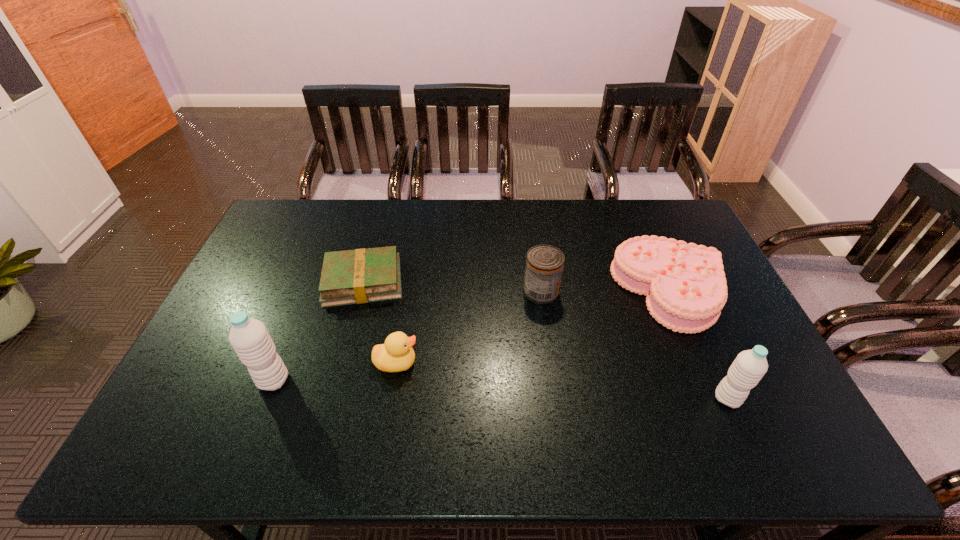
Find the location of a particular element. This screenshot has height=540, width=960. vacant region located 0.210m on the back of the shorter water bottle is located at coordinates (693, 324).

The image size is (960, 540). I want to click on vacant space located on the left of the shortest object, so click(x=261, y=282).

Where is `vacant space located on the back of the can`? The image size is (960, 540). vacant space located on the back of the can is located at coordinates (530, 210).

The height and width of the screenshot is (540, 960). I want to click on vacant space positioned on the face of the duckling, so point(471,363).

Find the location of a particular element. vacant area situated 0.130m on the front of the cake is located at coordinates (706, 374).

The image size is (960, 540). Find the location of `water bottle that is at the right edge`. water bottle that is at the right edge is located at coordinates (748, 368).

The height and width of the screenshot is (540, 960). I want to click on cake that is at the right edge, so click(x=685, y=284).

This screenshot has height=540, width=960. Find the location of `object at the near right corner`. object at the near right corner is located at coordinates (748, 368).

Where is `vacant space at the far edge`? This screenshot has height=540, width=960. vacant space at the far edge is located at coordinates (424, 230).

In the image, there is a desktop. In order to click on vacant space at the near edge in this screenshot , I will do `click(640, 383)`.